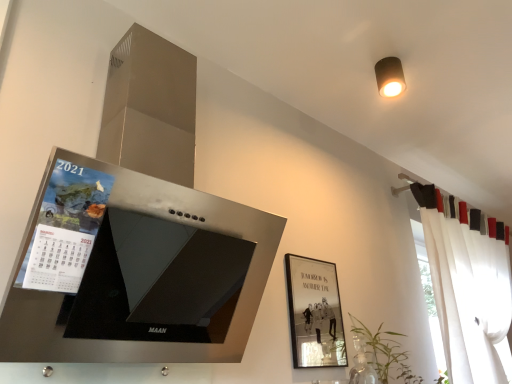
Question: Does green leafy plant at lower right turn towards matte brown cylindrical light fixture at upper right?

Choices:
 (A) no
 (B) yes

Answer: (A)

Question: Is green leafy plant at lower right outside of matte brown cylindrical light fixture at upper right?

Choices:
 (A) no
 (B) yes

Answer: (B)

Question: Can you confirm if green leafy plant at lower right is taller than matte brown cylindrical light fixture at upper right?

Choices:
 (A) no
 (B) yes

Answer: (B)

Question: Would you say green leafy plant at lower right is a long distance from matte brown cylindrical light fixture at upper right?

Choices:
 (A) yes
 (B) no

Answer: (A)

Question: Is green leafy plant at lower right shorter than matte brown cylindrical light fixture at upper right?

Choices:
 (A) yes
 (B) no

Answer: (B)

Question: In the image, is green leafy plant at lower right positioned in front of or behind matte paper calendar at left?

Choices:
 (A) behind
 (B) front

Answer: (A)

Question: From their relative heights in the image, would you say green leafy plant at lower right is taller or shorter than matte paper calendar at left?

Choices:
 (A) short
 (B) tall

Answer: (B)

Question: From a real-world perspective, is green leafy plant at lower right physically located above or below matte paper calendar at left?

Choices:
 (A) below
 (B) above

Answer: (A)

Question: Considering the positions of point (390, 365) and point (67, 289), is point (390, 365) closer or farther from the camera than point (67, 289)?

Choices:
 (A) farther
 (B) closer

Answer: (A)

Question: Considering the positions of green leafy plant at lower right and matte brown cylindrical light fixture at upper right in the image, is green leafy plant at lower right wider or thinner than matte brown cylindrical light fixture at upper right?

Choices:
 (A) wide
 (B) thin

Answer: (A)

Question: In the image, is green leafy plant at lower right positioned in front of or behind matte brown cylindrical light fixture at upper right?

Choices:
 (A) front
 (B) behind

Answer: (A)

Question: Looking at the image, does green leafy plant at lower right seem bigger or smaller compared to matte brown cylindrical light fixture at upper right?

Choices:
 (A) big
 (B) small

Answer: (A)

Question: Is green leafy plant at lower right inside the boundaries of matte brown cylindrical light fixture at upper right, or outside?

Choices:
 (A) inside
 (B) outside

Answer: (B)

Question: Is point (290, 261) closer or farther from the camera than point (385, 61)?

Choices:
 (A) closer
 (B) farther

Answer: (A)

Question: Is matte black picture frame at center-right spatially inside matte brown cylindrical light fixture at upper right, or outside of it?

Choices:
 (A) inside
 (B) outside

Answer: (B)